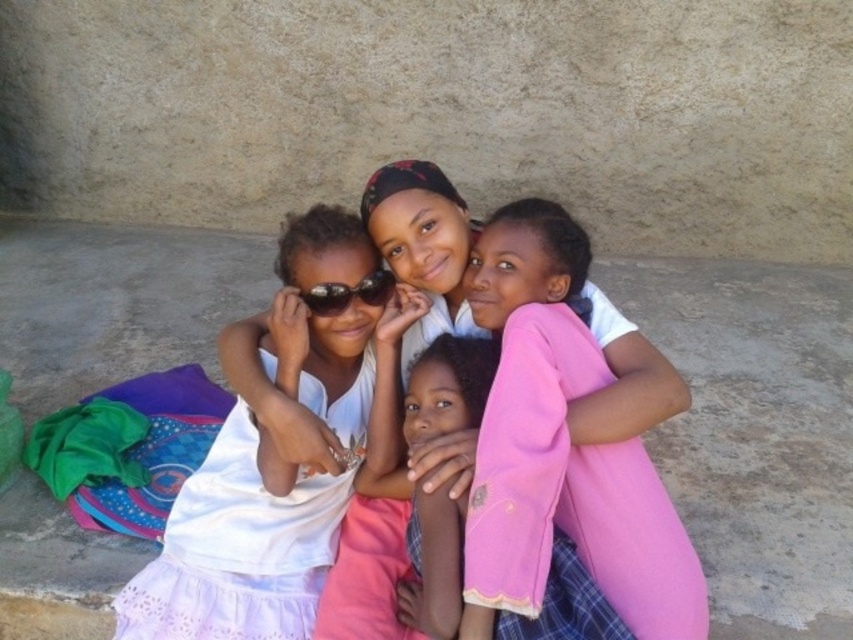
Question: Is white lace dress at lower left to the right of sunglasses at center from the viewer's perspective?

Choices:
 (A) no
 (B) yes

Answer: (A)

Question: Among these objects, which one is farthest from the camera?

Choices:
 (A) sunglasses at center
 (B) pink fleece jacket at center
 (C) white lace dress at lower left

Answer: (A)

Question: Based on their relative distances, which object is farther from the white lace dress at lower left?

Choices:
 (A) pink fleece jacket at center
 (B) sunglasses at center

Answer: (B)

Question: Which point is farther to the camera?

Choices:
 (A) pink fleece jacket at center
 (B) sunglasses at center

Answer: (B)

Question: Does pink fleece jacket at center have a smaller size compared to sunglasses at center?

Choices:
 (A) no
 (B) yes

Answer: (A)

Question: Observing the image, what is the correct spatial positioning of white lace dress at lower left in reference to sunglasses at center?

Choices:
 (A) left
 (B) right

Answer: (A)